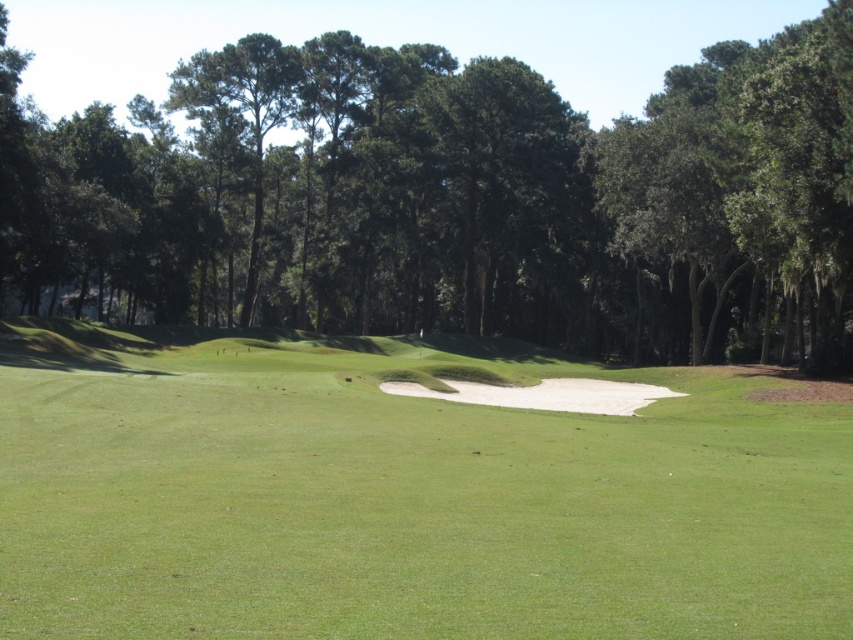
You are standing on the green grassy golf course at center and want to walk towards the green leafy tree at center. Which direction should you move to get closer to the tree?

Since the green grassy golf course at center is closer to the viewer than the green leafy tree at center, you should move forward in the direction of the tree to get closer to it.

You are standing at the sand trap in the center of the green grassy area. You see two points marked on the ground ahead of you. Which point is closer to you, point (x=828, y=508) or point (x=793, y=310)?

Point (x=828, y=508) is closer to the viewer than point (x=793, y=310).

You are a golfer standing on the green grassy golf course at center. You want to hit the ball towards the green leafy tree at center. Considering the height difference between the two, will the tree block your view of the golf course beyond it?

The green grassy golf course at center is shorter than the green leafy tree at center, so the tree will block your view of the golf course beyond it.